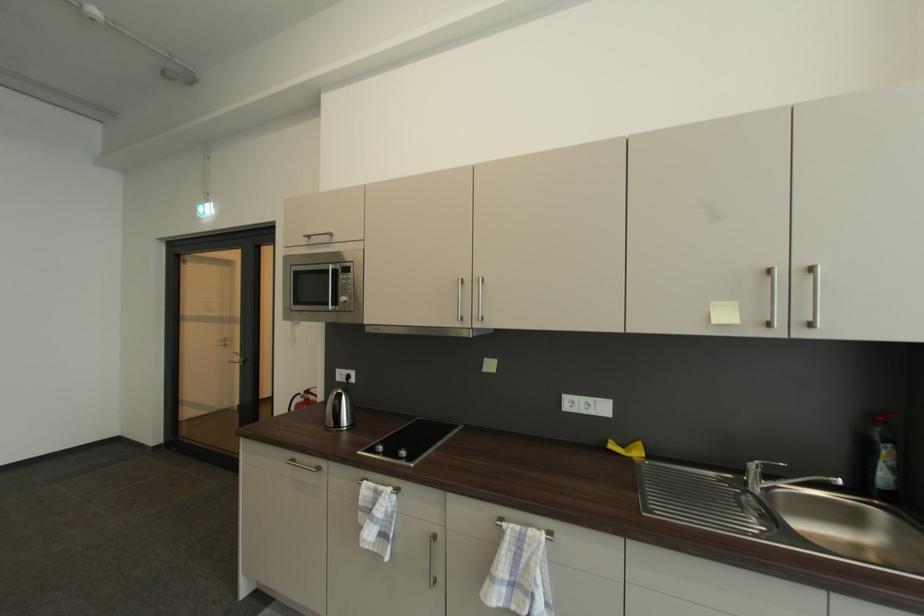
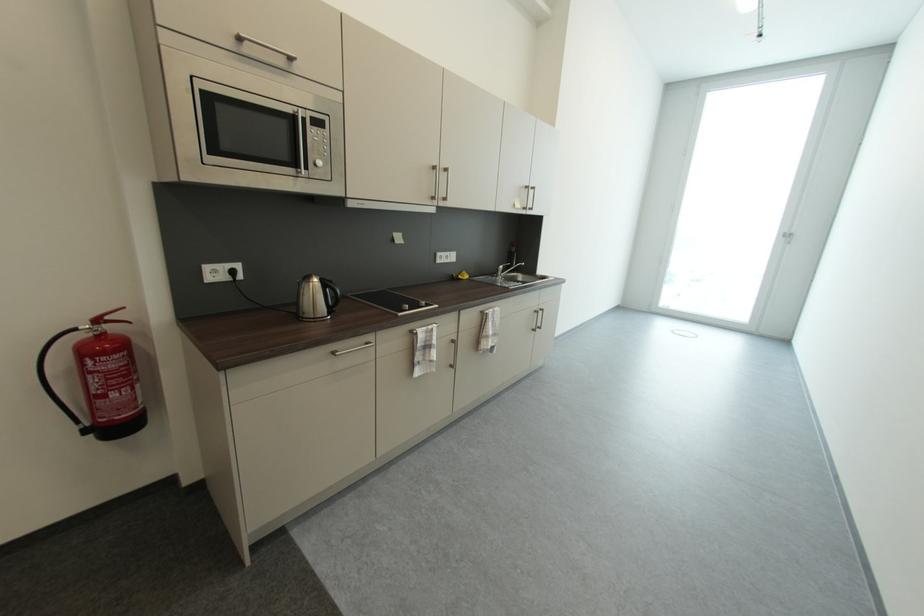
Find the pixel in the second image that matches [319,392] in the first image.

(116, 318)